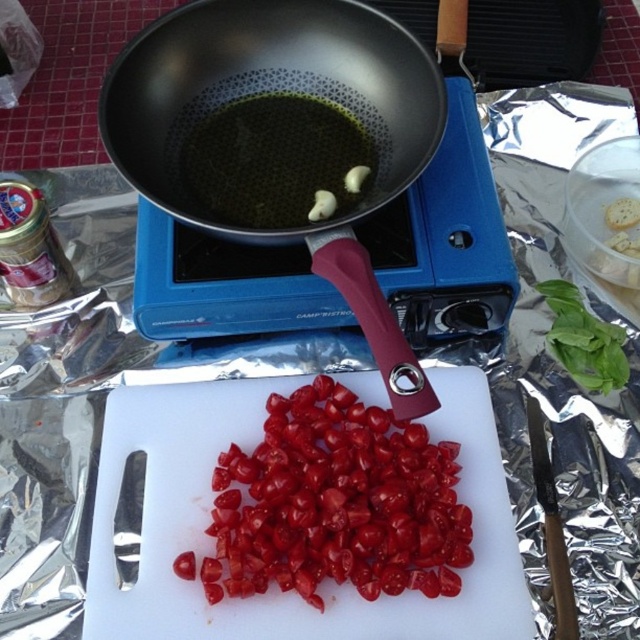
Question: Which object is closer to the camera taking this photo?

Choices:
 (A) black non-stick wok at center
 (B) glossy red tomato at center

Answer: (A)

Question: Is black non-stick wok at center thinner than glossy red tomato at center?

Choices:
 (A) yes
 (B) no

Answer: (B)

Question: Is black non-stick wok at center closer to the viewer compared to glossy red tomato at center?

Choices:
 (A) no
 (B) yes

Answer: (B)

Question: Can you confirm if black non-stick wok at center is positioned below glossy red tomato at center?

Choices:
 (A) no
 (B) yes

Answer: (A)